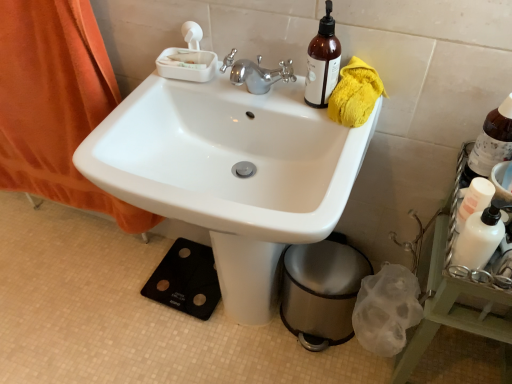
You are a GUI agent. You are given a task and a screenshot of the screen. Output one action in this format:
    pyautogui.click(x=<x>, y=<y>)
    Task: Click on the vacant space positioned to the left of orange fabric curtain at left
    
    Given the screenshot: What is the action you would take?
    pyautogui.click(x=31, y=236)